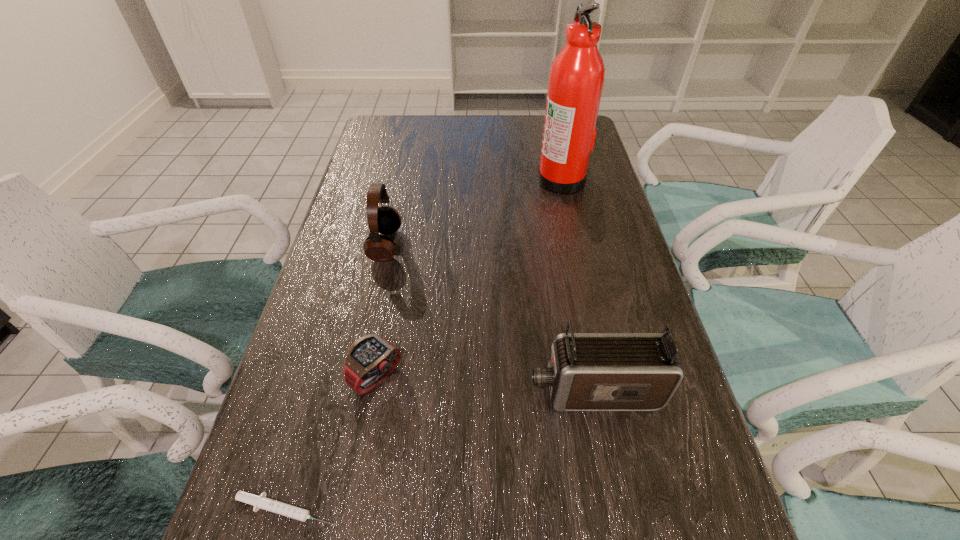
The height and width of the screenshot is (540, 960). I want to click on vacant space situated 0.340m at the lens of the camcorder, so click(348, 392).

Where is `vacant region located at the lens of the camcorder`? The width and height of the screenshot is (960, 540). vacant region located at the lens of the camcorder is located at coordinates (433, 392).

At what (x,y) coordinates should I click in order to perform the action: click on vacant space positioned 0.270m at the lens of the camcorder. Please return your answer as a coordinate pair (x, y). Looking at the image, I should click on (385, 392).

Where is `free space located 0.170m on the ear pads of the fourth nearest object`? Image resolution: width=960 pixels, height=540 pixels. free space located 0.170m on the ear pads of the fourth nearest object is located at coordinates (468, 245).

The width and height of the screenshot is (960, 540). What are the coordinates of `vacant space located 0.130m on the front of the fourth tallest object` in the screenshot? It's located at (359, 474).

Where is `free location located on the right of the shortest object`? free location located on the right of the shortest object is located at coordinates (434, 509).

Locate an element on the screen. headset that is at the left edge is located at coordinates (386, 220).

You are a GUI agent. You are given a task and a screenshot of the screen. Output one action in this format:
    pyautogui.click(x=<x>, y=<y>)
    Task: Click on the watch at the left edge
    The image size is (960, 540).
    Given the screenshot: What is the action you would take?
    pyautogui.click(x=370, y=359)

Locate an element on the screen. This screenshot has height=540, width=960. syringe at the left edge is located at coordinates (259, 502).

This screenshot has height=540, width=960. I want to click on fire extinguisher located at the right edge, so 576,79.